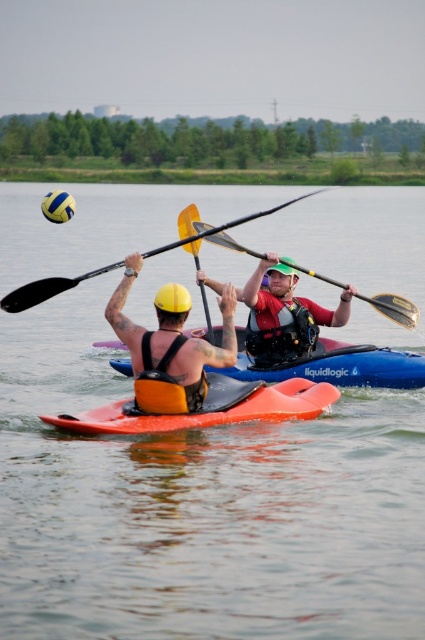
You are standing on the shore of the lake and see the point at coordinates point (x=181, y=392). You want to throw a ball to hit that point. If your maximum throwing distance is 20 meters, will you be able to reach it?

The distance between point (x=181, y=392) and the viewer is 20.56 meters, which exceeds your maximum throwing distance of 20 meters. Therefore, you won not be able to reach it.

You are a safety inspector checking the equipment of the kayakers. You notice the orange life vest at center and the yellow matte paddle at center. Based on their sizes, which one might be more appropriate for a child? Explain your reasoning.

The orange life vest at center has a smaller size compared to the yellow matte paddle at center. Since life vests are sized for the wearer, the smaller orange life vest at center is more appropriate for a child.

You are a safety inspector checking the kayakers. According to the image, is the orange life vest at center properly secured under the yellow matte paddle at center?

The orange life vest at center is positioned under the yellow matte paddle at center, which indicates that the paddle is placed on top of the life vest. This suggests that the life vest might not be properly secured as it should be worn snugly on the body, not underneath equipment.